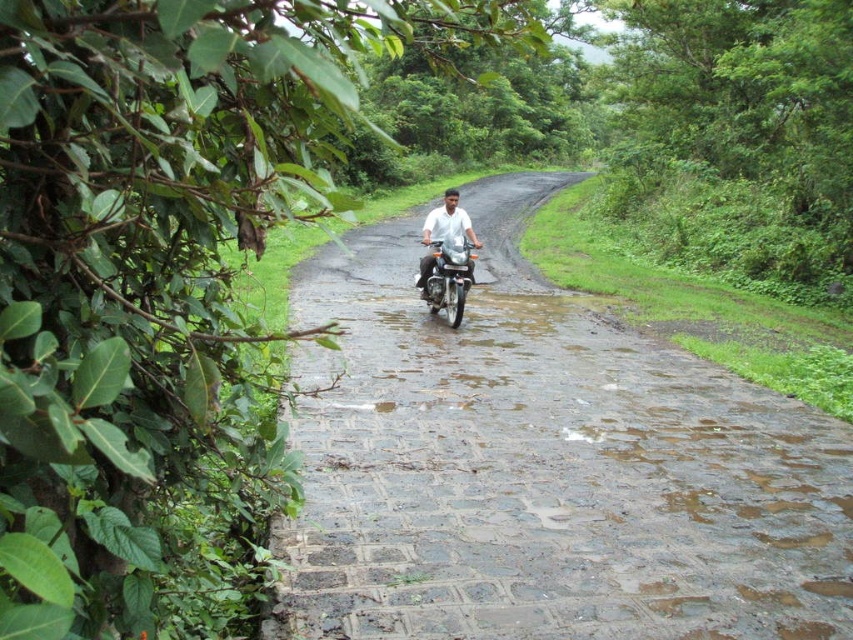
Question: Which object appears farthest from the camera in this image?

Choices:
 (A) paved stone road at center
 (B) metallic silver motorcycle at center
 (C) white matte shirt at center

Answer: (C)

Question: Does metallic silver motorcycle at center have a lesser width compared to white matte shirt at center?

Choices:
 (A) yes
 (B) no

Answer: (A)

Question: Is metallic silver motorcycle at center to the left of white matte shirt at center from the viewer's perspective?

Choices:
 (A) no
 (B) yes

Answer: (A)

Question: Which point is farther from the camera taking this photo?

Choices:
 (A) (577, 310)
 (B) (462, 243)

Answer: (A)

Question: From the image, what is the correct spatial relationship of metallic silver motorcycle at center in relation to white matte shirt at center?

Choices:
 (A) below
 (B) above

Answer: (A)

Question: Which point is closer to the camera taking this photo?

Choices:
 (A) (445, 193)
 (B) (463, 253)
 (C) (491, 275)

Answer: (B)